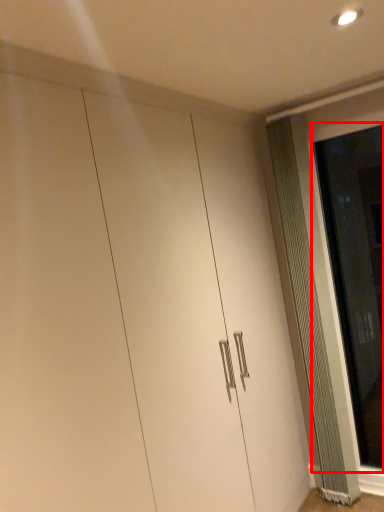
Question: Observing the image, what is the correct spatial positioning of screen door (annotated by the red box) in reference to radiator?

Choices:
 (A) left
 (B) right

Answer: (B)